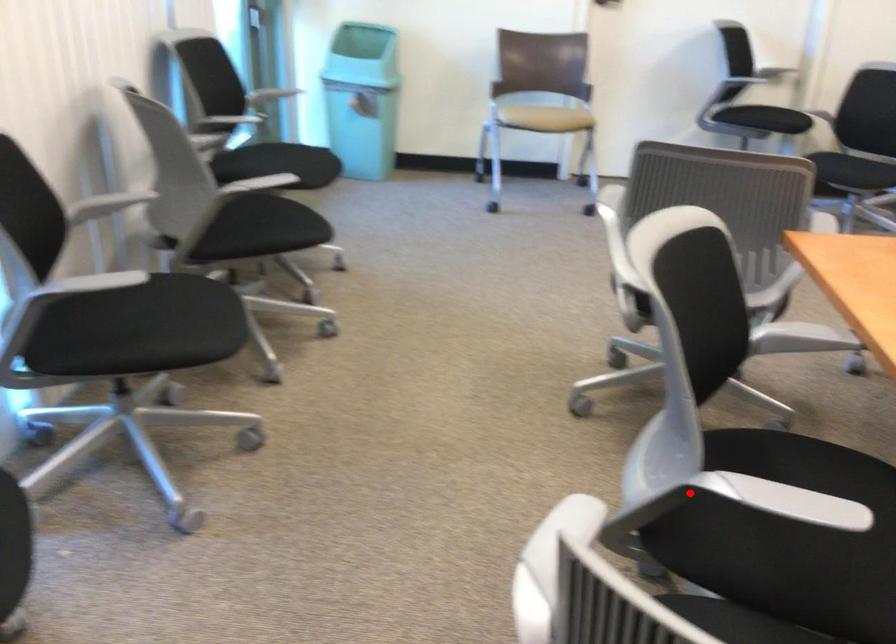
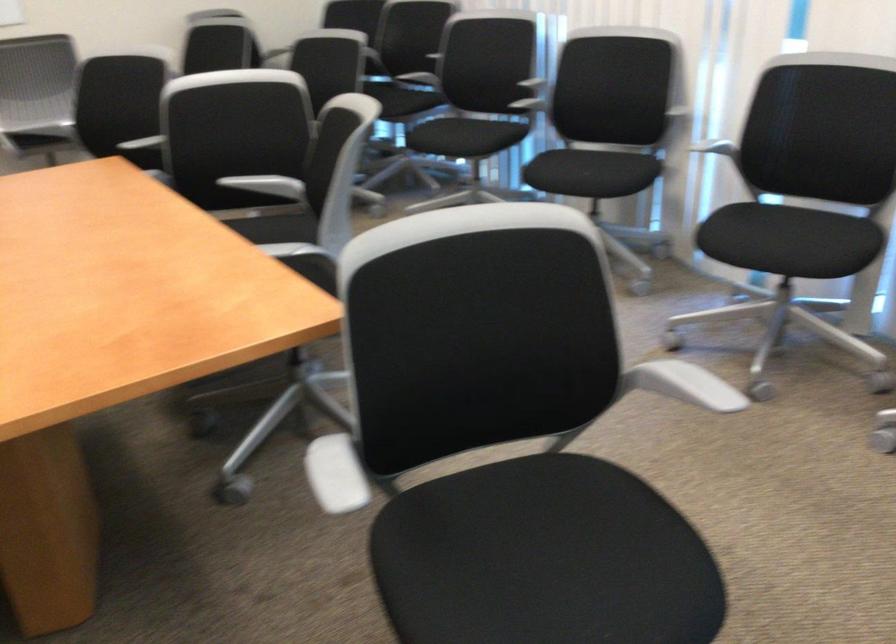
Question: I am providing you with two images of the same scene from different viewpoints. A red point is shown in image1. For the corresponding object point in image2, is it positioned nearer or farther from the camera?

Choices:
 (A) Nearer
 (B) Farther

Answer: (B)